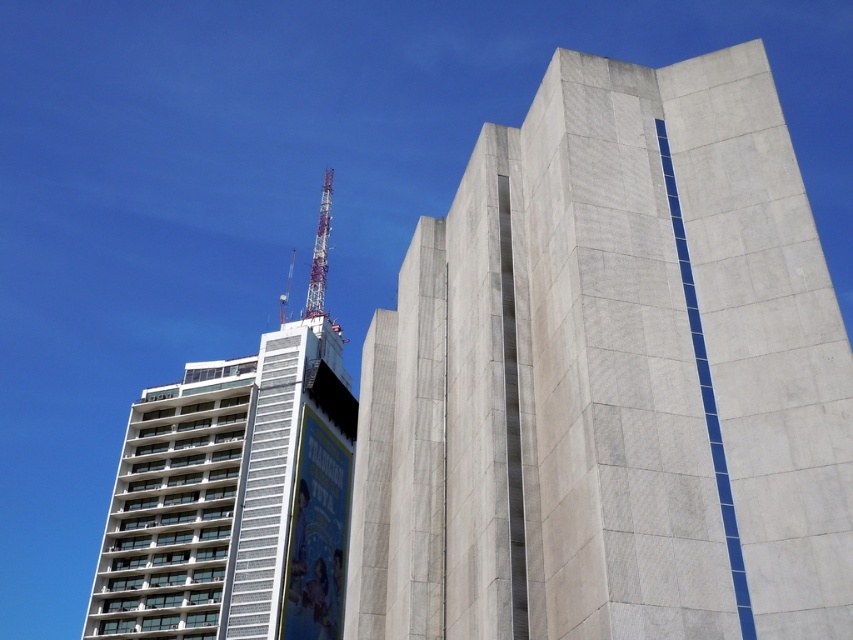
Question: Does concrete block building at center come in front of white concrete building at upper left?

Choices:
 (A) yes
 (B) no

Answer: (A)

Question: In this image, where is white concrete building at upper left located relative to metallic silver crane at upper center?

Choices:
 (A) left
 (B) right

Answer: (B)

Question: Which point is farther to the camera?

Choices:
 (A) (318, 301)
 (B) (286, 300)
 (C) (178, 454)

Answer: (B)

Question: Which point appears farthest from the camera in this image?

Choices:
 (A) (202, 563)
 (B) (459, 234)
 (C) (318, 214)

Answer: (C)

Question: Based on their relative distances, which object is nearer to the metallic silver crane at upper center?

Choices:
 (A) white concrete building at upper left
 (B) metallic tower at upper center
 (C) concrete block building at center

Answer: (B)

Question: Can you confirm if metallic tower at upper center is bigger than metallic silver crane at upper center?

Choices:
 (A) yes
 (B) no

Answer: (A)